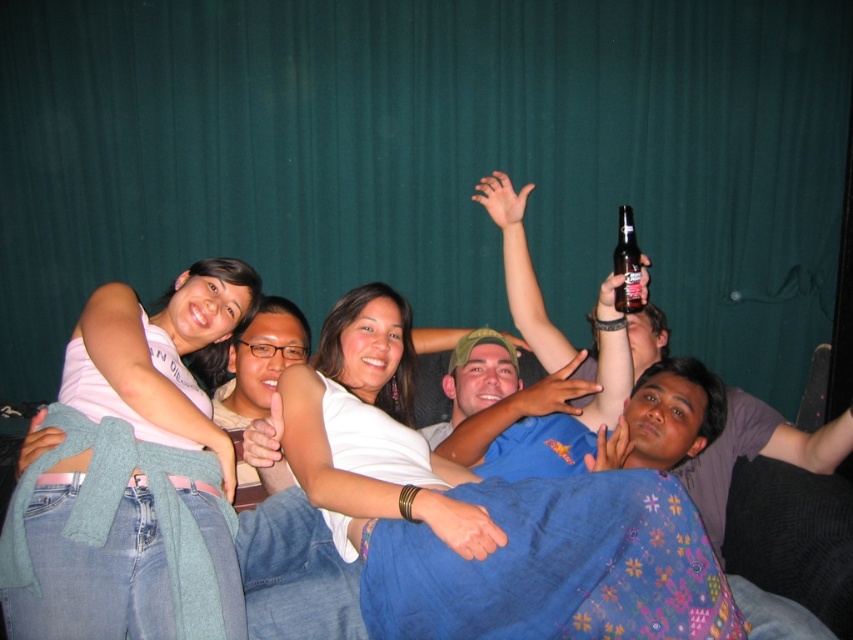
You are a photographer adjusting your camera settings to capture the scene. You notice the white matte tank top at center and the clear glass bottle at upper right. Which object should you focus on first if you want to ensure both are in sharp focus, considering their positions?

The white matte tank top at center is below the clear glass bottle at upper right. To ensure both are in sharp focus, focus on the clear glass bottle at upper right first since it is farther away, as depth of field typically extends further behind the point of focus than in front.

You are a photographer adjusting your camera settings to focus on the white matte tank top at center and the clear glass bottle at upper right. Since you want both objects to be in focus, which one should you focus on first to ensure proper depth of field?

You should focus on the white matte tank top at center first because it is closer to the viewer than the clear glass bottle at upper right. By focusing on the closer object, the depth of field will extend backward, potentially keeping both in focus.

In the scene shown: You are standing in front of the image and want to identify the central figure. Which object is located at the coordinates point (132, 477)?

The point (132, 477) corresponds to the white matte tank top at center, which is the central figure in the image.